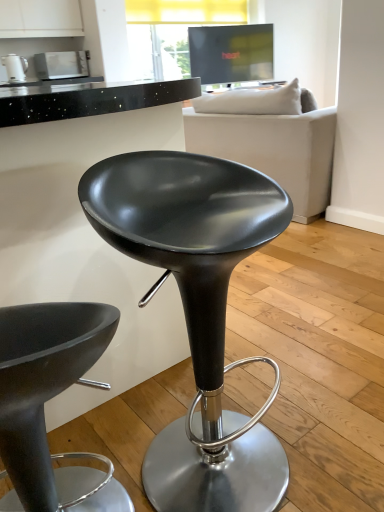
Question: From the image's perspective, is matte black stool at center, which is the 2th chair in right-to-left order, located above or below matte white microwave at upper left, which is the second appliance in front-to-back order?

Choices:
 (A) below
 (B) above

Answer: (A)

Question: Considering the positions of point (36, 412) and point (77, 74), is point (36, 412) closer or farther from the camera than point (77, 74)?

Choices:
 (A) closer
 (B) farther

Answer: (A)

Question: Estimate the real-world distances between objects in this image. Which object is farther from the matte black stool at center, the second chair in the left-to-right sequence?

Choices:
 (A) matte black stool at center, which is the 2th chair in right-to-left order
 (B) white fabric couch at upper center
 (C) matte white kettle at upper left, which ranks as the 2th appliance in right-to-left order
 (D) matte white microwave at upper left, the first appliance viewed from the back

Answer: (D)

Question: Based on their relative distances, which object is farther from the matte black stool at center, the second chair in the left-to-right sequence?

Choices:
 (A) matte white microwave at upper left, which is the second appliance in front-to-back order
 (B) matte black stool at center, which is the 2th chair in right-to-left order
 (C) matte white kettle at upper left, positioned as the 1th appliance in front-to-back order
 (D) white fabric couch at upper center

Answer: (A)